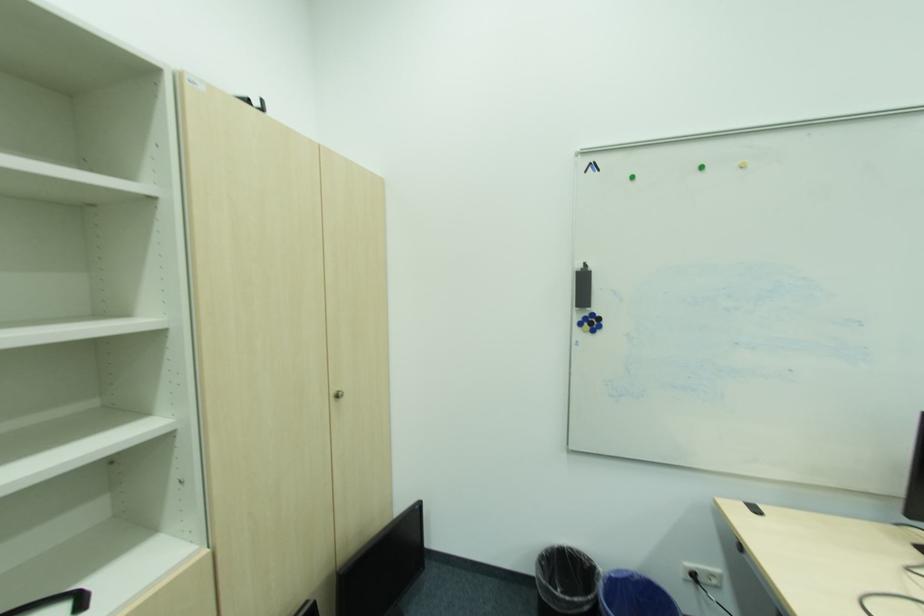
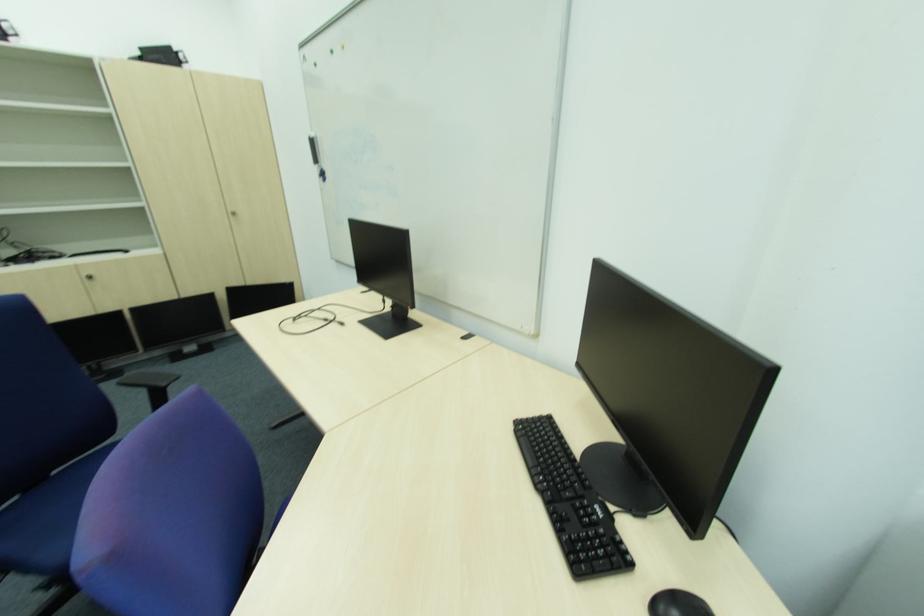
The point at (578, 315) is marked in the first image. Where is the corresponding point in the second image?

(322, 172)